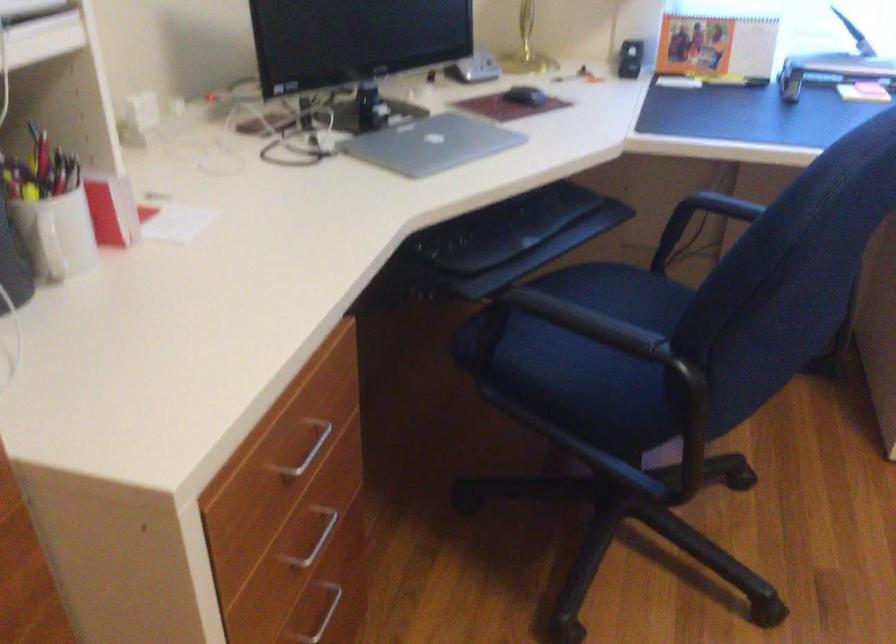
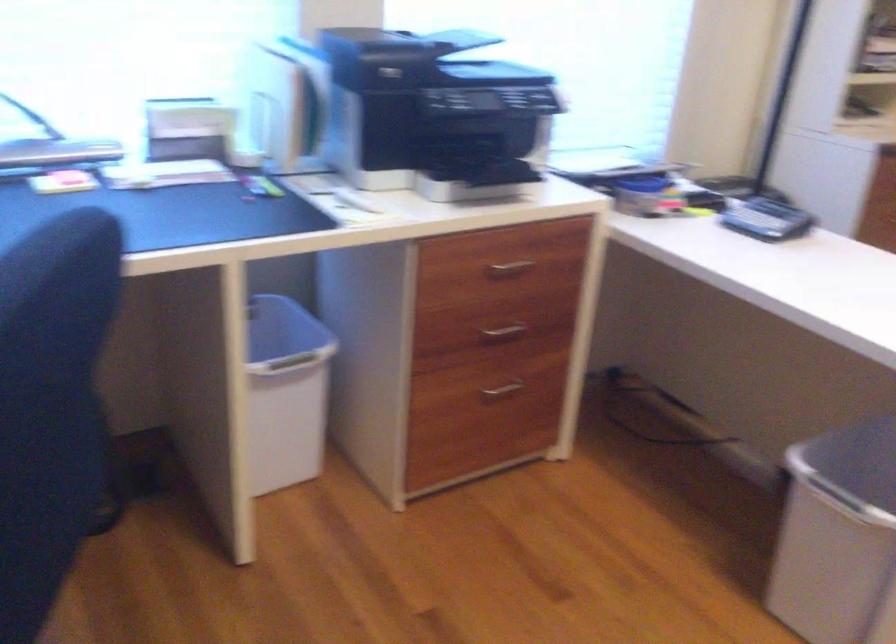
Question: Based on the continuous images, in which direction is the camera rotating? Reply with the corresponding letter.

Choices:
 (A) Left
 (B) Right
 (C) Up
 (D) Down

Answer: (B)